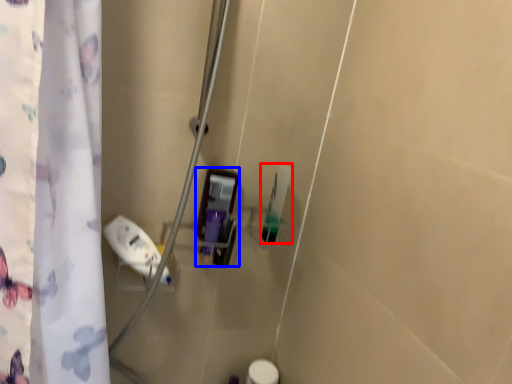
Question: Which of the following is the closest to the observer, toiletry (highlighted by a red box) or toiletry (highlighted by a blue box)?

Choices:
 (A) toiletry
 (B) toiletry

Answer: (B)